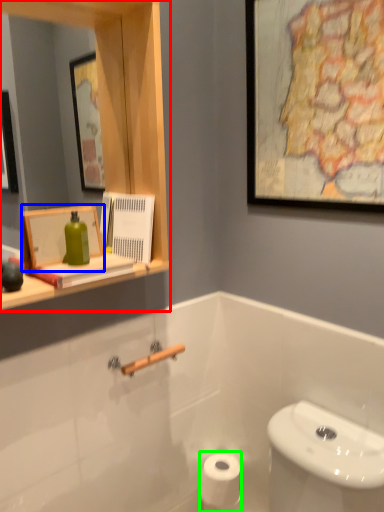
Question: Based on their relative distances, which object is nearer to medicine cabinet (highlighted by a red box)? Choose from picture frame (highlighted by a blue box) and toilet paper (highlighted by a green box).

Choices:
 (A) picture frame
 (B) toilet paper

Answer: (A)